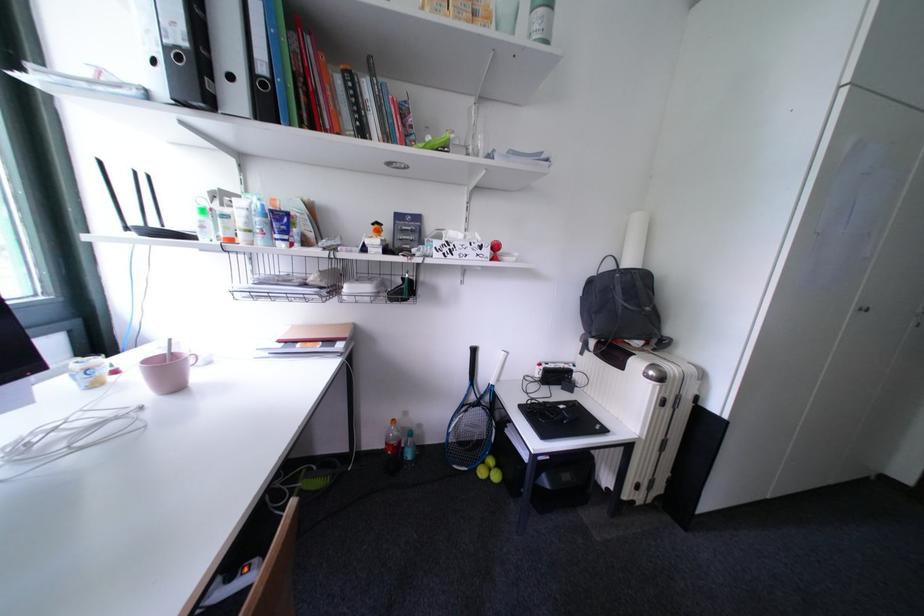
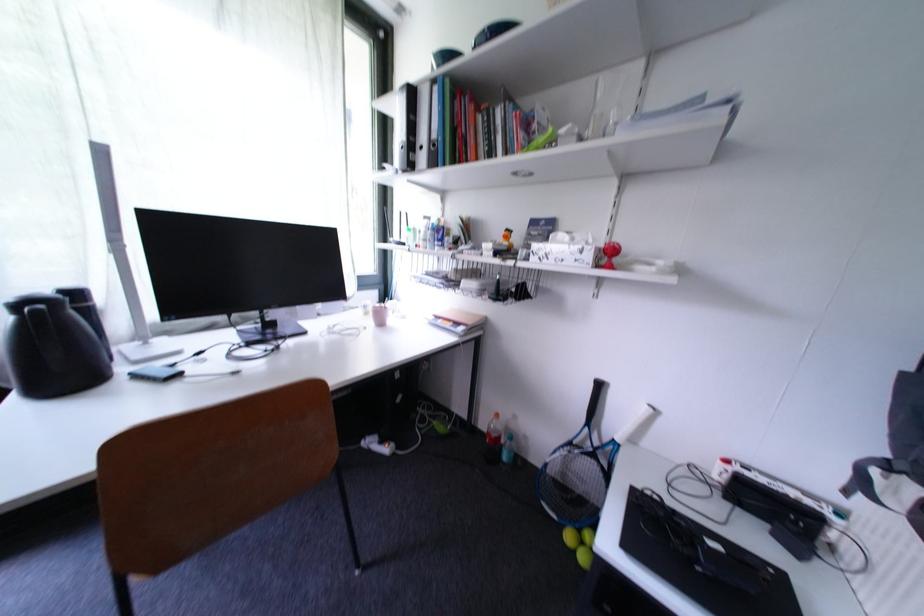
Find the pixel in the second image that matches (x=395, y=440) in the first image.

(497, 429)